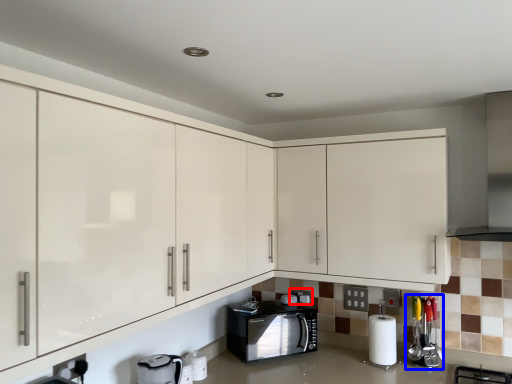
Question: Which point is further to the camera, appliance (highlighted by a red box) or appliance (highlighted by a blue box)?

Choices:
 (A) appliance
 (B) appliance

Answer: (A)